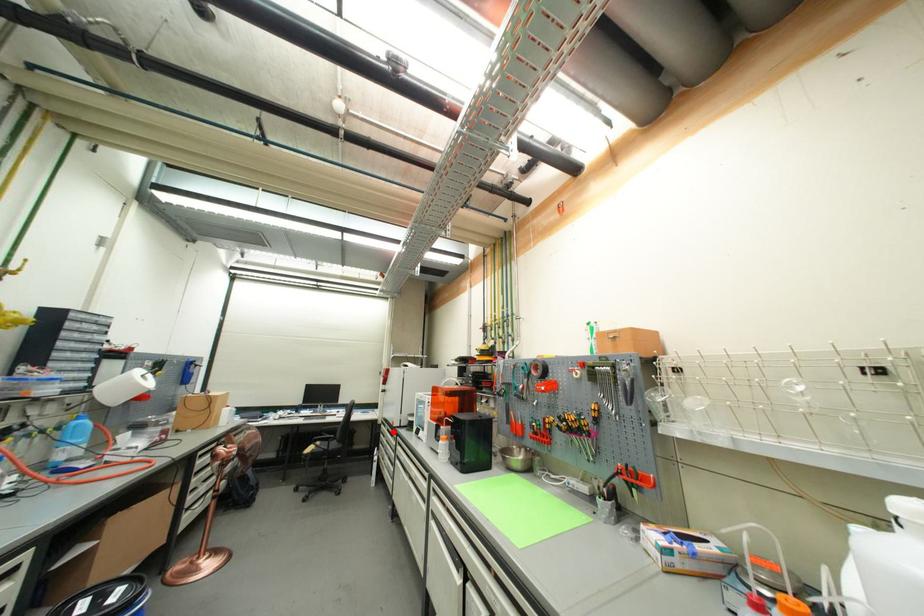
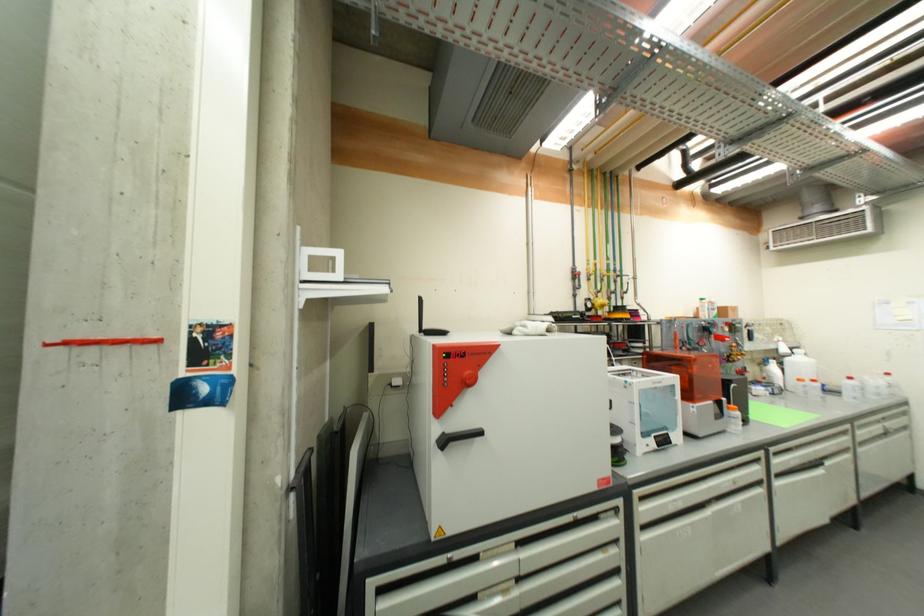
Question: I am providing you with two images of the same scene from different viewpoints. In image1, a red point is highlighted. Considering the same 3D point in image2, which of the following is correct?

Choices:
 (A) It is closer
 (B) It is farther

Answer: (A)